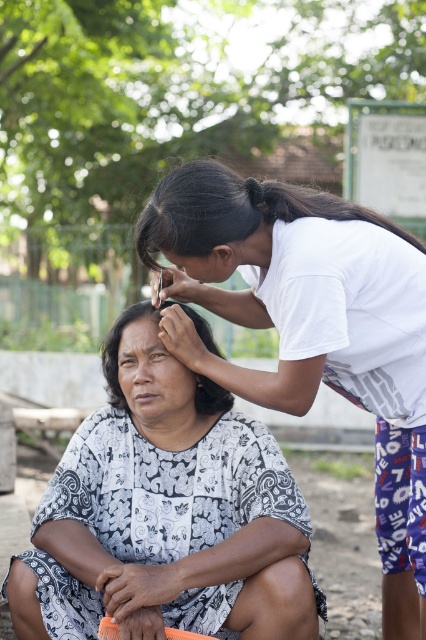
Is white printed fabric at lower left positioned in front of matte black forehead at center?

Yes, it is in front of matte black forehead at center.

From the picture: Between white printed fabric at lower left and matte black forehead at center, which one is positioned lower?

Positioned lower is white printed fabric at lower left.

Is point (114, 456) closer to camera compared to point (131, 333)?

No, it is not.

The width and height of the screenshot is (426, 640). I want to click on white printed fabric at lower left, so click(166, 516).

How much distance is there between black silky hair at upper center and brown wooden comb at upper center?

The distance of black silky hair at upper center from brown wooden comb at upper center is 4.06 feet.

Which is above, black silky hair at upper center or brown wooden comb at upper center?

black silky hair at upper center is above.

Between point (302, 195) and point (166, 628), which one is positioned in front?

Point (166, 628) is in front.

Identify the location of black silky hair at upper center. (233, 211).

Is white patterned hair at center taller than brown wooden comb at upper center?

Yes, white patterned hair at center is taller than brown wooden comb at upper center.

Is white patterned hair at center to the left of brown wooden comb at upper center from the viewer's perspective?

Yes, white patterned hair at center is to the left of brown wooden comb at upper center.

Locate an element on the screen. The height and width of the screenshot is (640, 426). white patterned hair at center is located at coordinates (118, 348).